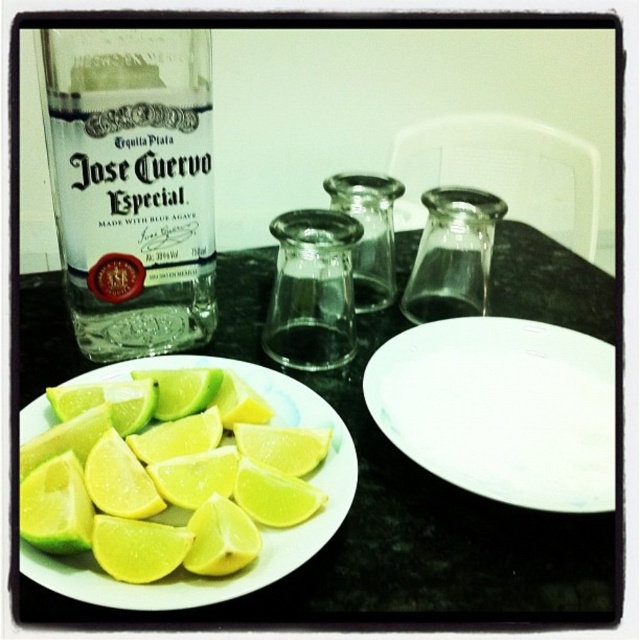
Where is `green matte lime slices at lower left`? green matte lime slices at lower left is located at coordinates (259, 525).

At what (x,y) coordinates should I click in order to perform the action: click on green matte lime slices at lower left. Please return your answer as a coordinate pair (x, y). This screenshot has height=640, width=640. Looking at the image, I should click on (259, 525).

The height and width of the screenshot is (640, 640). I want to click on green matte plate at lower left, so click(428, 538).

Can you confirm if green matte plate at lower left is taller than transparent glass salt shaker at center-right?

Correct, green matte plate at lower left is much taller as transparent glass salt shaker at center-right.

At what (x,y) coordinates should I click in order to perform the action: click on green matte plate at lower left. Please return your answer as a coordinate pair (x, y). Image resolution: width=640 pixels, height=640 pixels. Looking at the image, I should click on (428, 538).

Image resolution: width=640 pixels, height=640 pixels. What are the coordinates of `green matte plate at lower left` in the screenshot? It's located at (428, 538).

Does transparent glass salt shaker at center-right have a greater height compared to yellow matte lemon at lower left?

Yes.

Is point (433, 257) closer to viewer compared to point (259, 472)?

No.

The width and height of the screenshot is (640, 640). Describe the element at coordinates (452, 253) in the screenshot. I see `transparent glass salt shaker at center-right` at that location.

Locate an element on the screen. transparent glass salt shaker at center-right is located at coordinates (452, 253).